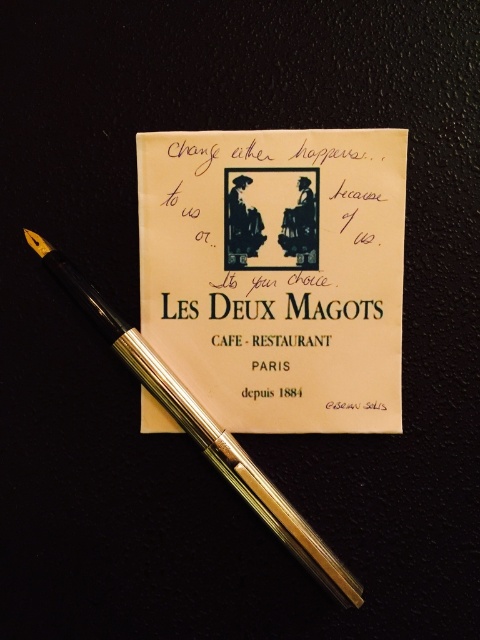
Who is more forward, (344,362) or (133,371)?

Point (133,371) is more forward.

Between white paper sign at center and gold polished fountain pen at center, which one appears on the left side from the viewer's perspective?

Positioned to the left is gold polished fountain pen at center.

Which is in front, point (344, 285) or point (330, 589)?

Point (330, 589) is in front.

Where is `white paper sign at center`? This screenshot has width=480, height=640. white paper sign at center is located at coordinates (276, 273).